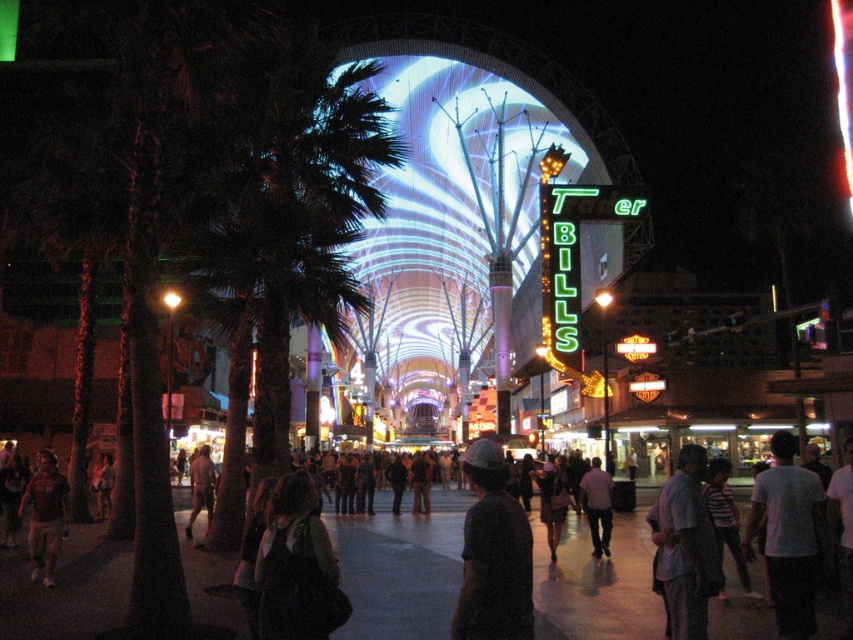
Does white matte shirt at lower right come behind light purple shirt at center?

No, white matte shirt at lower right is closer to the viewer.

What do you see at coordinates (787, 536) in the screenshot?
I see `white matte shirt at lower right` at bounding box center [787, 536].

Locate an element on the screen. The image size is (853, 640). white matte shirt at lower right is located at coordinates (787, 536).

Locate an element on the screen. The image size is (853, 640). white matte shirt at lower right is located at coordinates (787, 536).

Who is positioned more to the right, dark fabric bag at center or white matte shirt at lower right?

From the viewer's perspective, white matte shirt at lower right appears more on the right side.

Is dark fabric bag at center taller than white matte shirt at lower right?

No, dark fabric bag at center is not taller than white matte shirt at lower right.

Does point (311, 547) come closer to viewer compared to point (779, 563)?

That is True.

Find the location of a particular element. This screenshot has height=640, width=853. dark fabric bag at center is located at coordinates pyautogui.click(x=296, y=566).

Is white matte shirt at lower right further to the viewer compared to dark gray shirt at lower right?

Yes, white matte shirt at lower right is further from the viewer.

Between point (770, 436) and point (700, 472), which one is positioned behind?

Point (770, 436)

This screenshot has width=853, height=640. Identify the location of white matte shirt at lower right. 787,536.